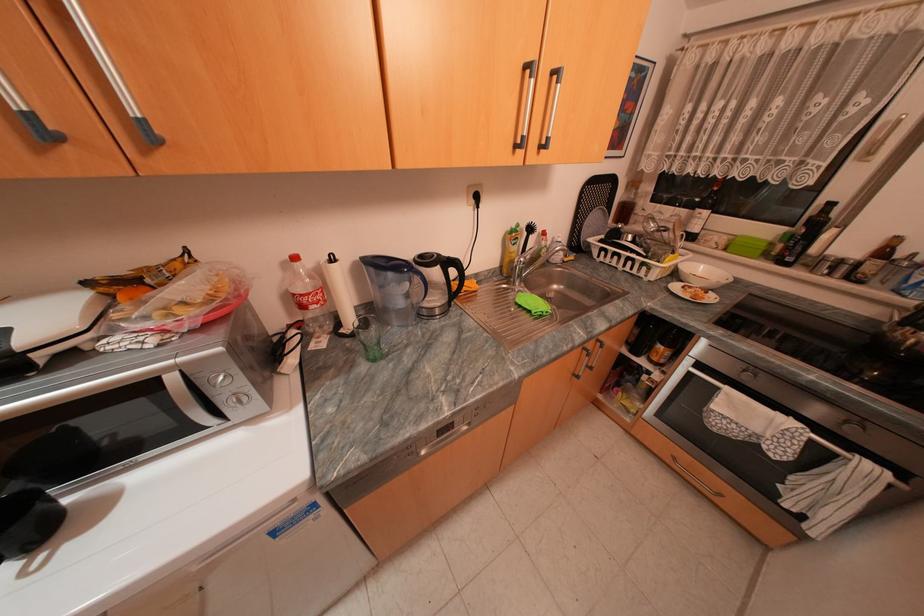
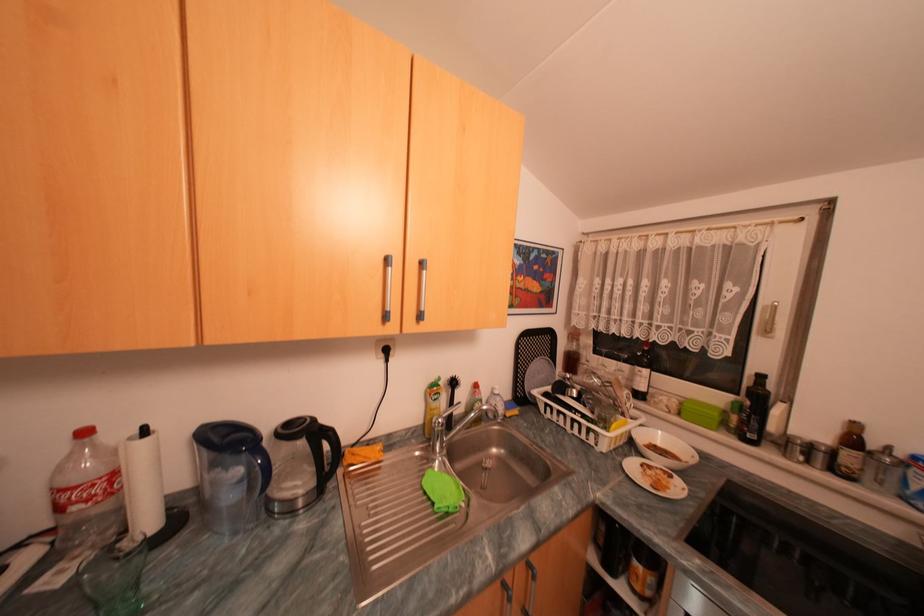
Where in the second image is the point corresponding to pixel 305 257 from the first image?

(94, 432)